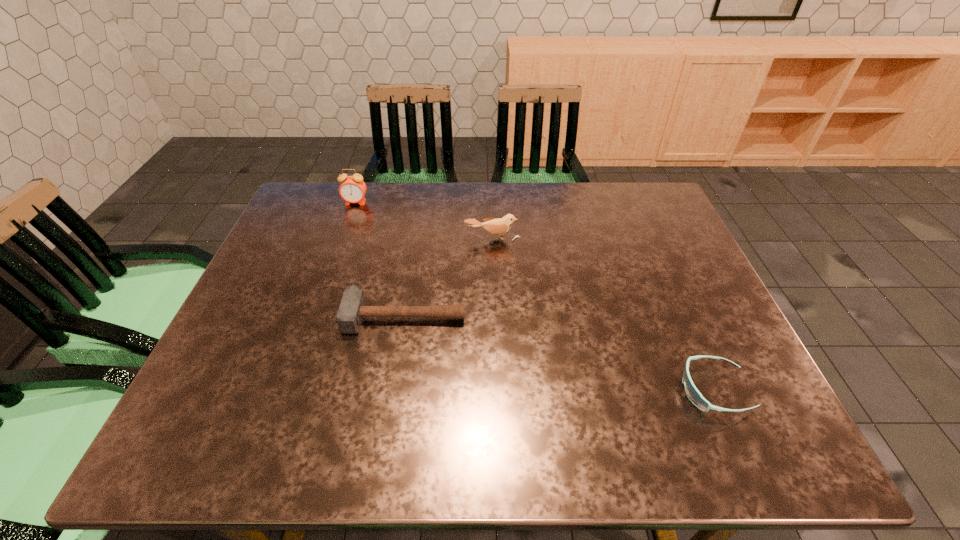
Find the location of `free space located on the front-facing side of the goggles`. free space located on the front-facing side of the goggles is located at coordinates (507, 390).

Locate an element on the screen. The height and width of the screenshot is (540, 960). vacant space located 0.210m on the front-facing side of the goggles is located at coordinates (580, 390).

Identify the location of free spot located 0.250m on the front-facing side of the goggles. (561, 390).

The width and height of the screenshot is (960, 540). I want to click on object situated at the far edge, so click(352, 189).

Find the location of `object that is at the near edge`. object that is at the near edge is located at coordinates (693, 394).

You are a GUI agent. You are given a task and a screenshot of the screen. Output one action in this format:
    pyautogui.click(x=<x>, y=<y>)
    Task: Click on the object that is at the left edge
    The image size is (960, 540).
    Given the screenshot: What is the action you would take?
    pyautogui.click(x=352, y=189)

Identify the location of object present at the right edge. The width and height of the screenshot is (960, 540). (693, 394).

Locate an element on the screen. This screenshot has height=540, width=960. object present at the far left corner is located at coordinates (352, 189).

Find the location of a particular element. This screenshot has width=960, height=540. object that is at the near right corner is located at coordinates (693, 394).

You are a GUI agent. You are given a task and a screenshot of the screen. Output one action in this format:
    pyautogui.click(x=<x>, y=<y>)
    Task: Click on the vacant space at the far edge of the desktop
    The width and height of the screenshot is (960, 540).
    Given the screenshot: What is the action you would take?
    pyautogui.click(x=401, y=197)